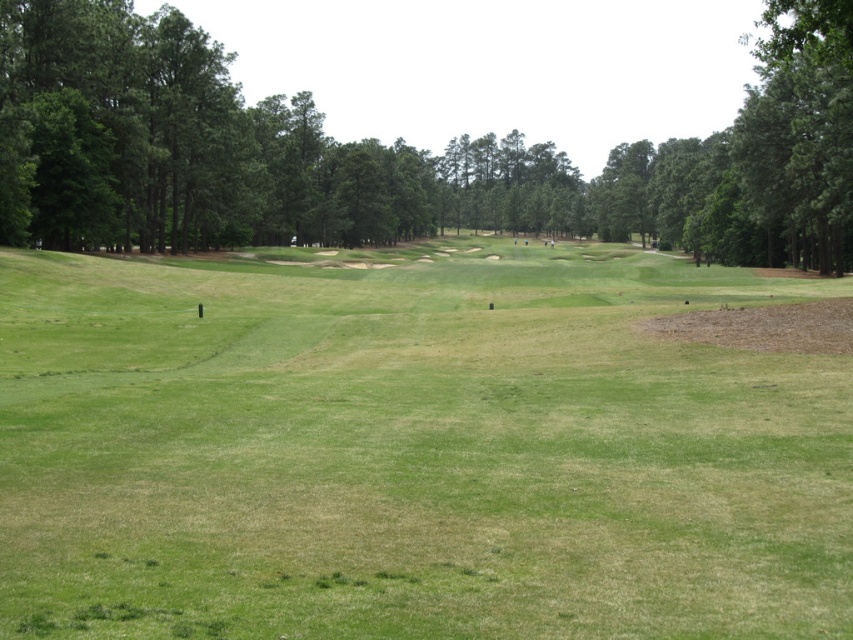
You are a golfer standing on the green grassy field at center. You want to hit a golf ball to the green leafy tree at center. Given that your golf club can hit the ball up to 80 meters, will you be able to reach the tree with one shot?

The distance between the green grassy field at center and the green leafy tree at center is 78.31 meters. Since your golf club can hit up to 80 meters, you can reach the tree with one shot.